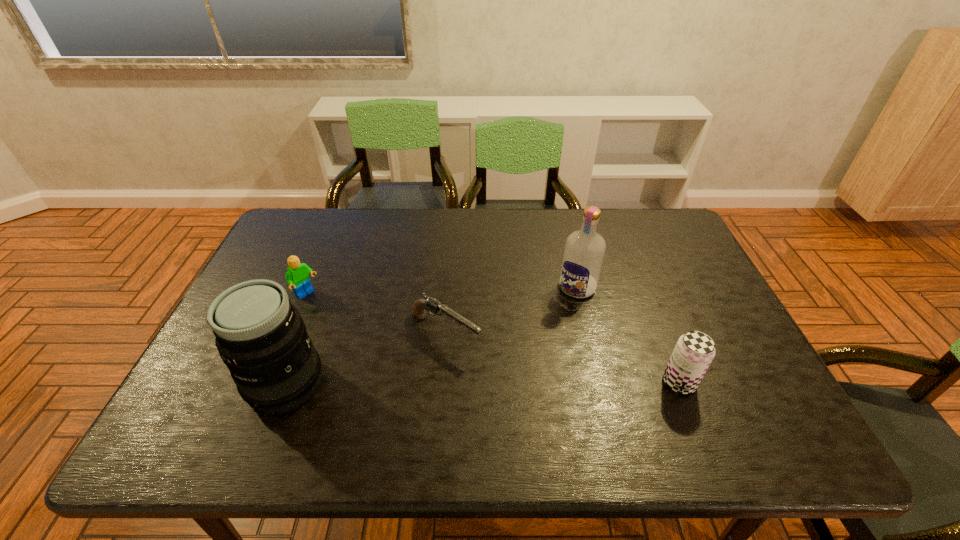
Image resolution: width=960 pixels, height=540 pixels. Find the location of `telephoto lens`. telephoto lens is located at coordinates (261, 337).

You are a GUI agent. You are given a task and a screenshot of the screen. Output one action in this format:
    pyautogui.click(x=<x>, y=<y>)
    Task: Click on the rightmost object
    The image size is (960, 540).
    Given the screenshot: What is the action you would take?
    pyautogui.click(x=694, y=351)

Where is `vodka`? The width and height of the screenshot is (960, 540). vodka is located at coordinates (584, 251).

Identify the location of Lego. (297, 274).

Locate an element on the screen. The image size is (960, 540). gun is located at coordinates (430, 304).

What are the coordinates of `the shortest object` in the screenshot? It's located at (430, 304).

I want to click on free space located on the back of the telephoto lens, so click(308, 326).

Where is `blank area located on the right of the beer can`? The width and height of the screenshot is (960, 540). blank area located on the right of the beer can is located at coordinates (760, 382).

Where is `vacant area situated 0.340m on the label of the fourth object from left to right`? vacant area situated 0.340m on the label of the fourth object from left to right is located at coordinates (506, 385).

Locate an element on the screen. free space located on the label of the fourth object from left to right is located at coordinates (546, 330).